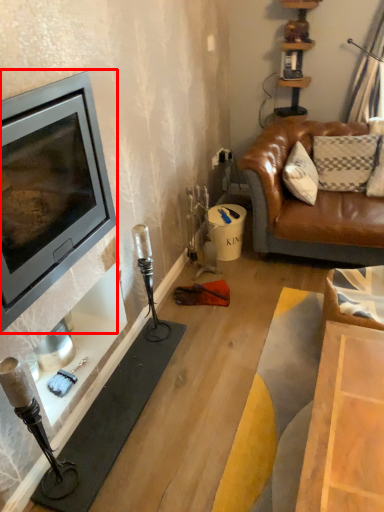
Question: Considering the relative positions of wood burning stove (annotated by the red box) and fireplace in the image provided, where is wood burning stove (annotated by the red box) located with respect to the staircase?

Choices:
 (A) left
 (B) right

Answer: (A)